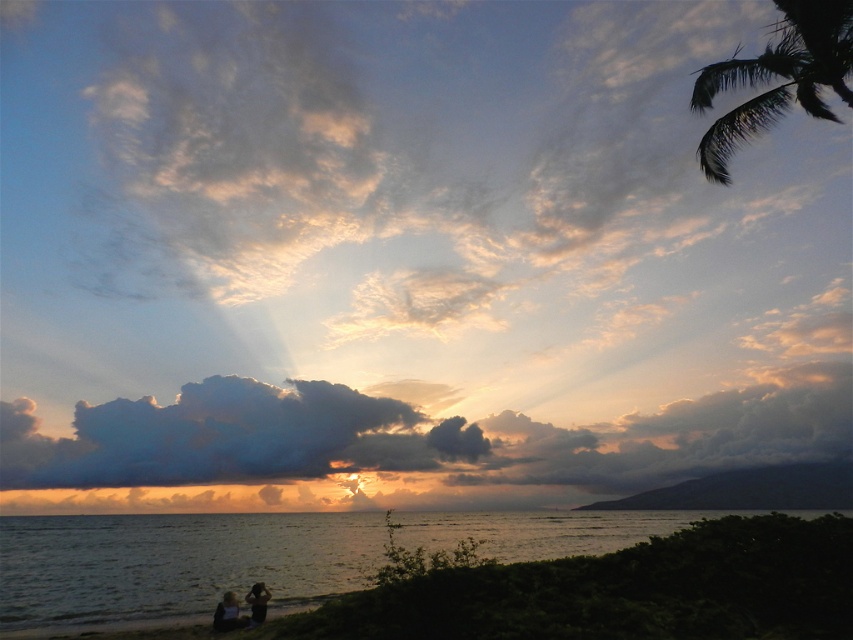
Question: Can you confirm if shiny blue water at lower left is smaller than cloudy sky at center?

Choices:
 (A) no
 (B) yes

Answer: (A)

Question: Estimate the real-world distances between objects in this image. Which object is closer to the silvery metallic couple at lower center?

Choices:
 (A) shiny blue water at lower left
 (B) dark green leafy palm tree at upper right

Answer: (B)

Question: Is shiny blue water at lower left positioned before cloudy sky at center?

Choices:
 (A) yes
 (B) no

Answer: (A)

Question: Considering the real-world distances, which object is closest to the cloudy sky at center?

Choices:
 (A) silvery metallic couple at lower center
 (B) shiny blue water at lower left

Answer: (B)

Question: Based on their relative distances, which object is farther from the dark green leafy palm tree at upper right?

Choices:
 (A) smooth skin person at lower center
 (B) cloudy sky at center
 (C) silvery metallic couple at lower center

Answer: (B)

Question: Can you confirm if silvery metallic couple at lower center is positioned to the right of smooth skin person at lower left?

Choices:
 (A) no
 (B) yes

Answer: (B)